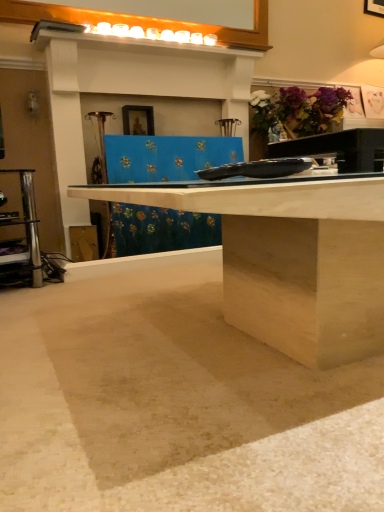
Image resolution: width=384 pixels, height=512 pixels. I want to click on free spot above beige matte concrete at lower center (from a real-world perspective), so tap(132, 327).